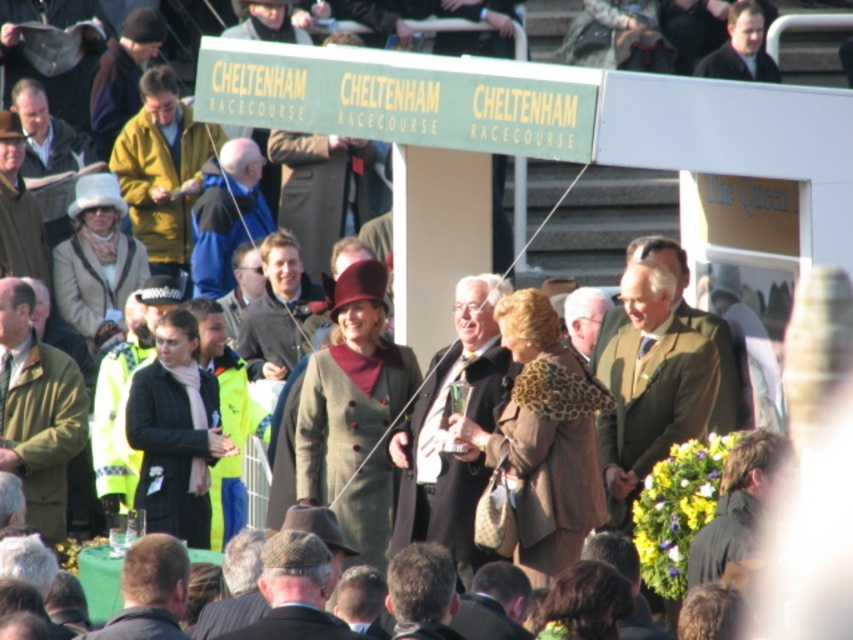
Question: Is green wool coat at left smaller than brown tweed hat at lower center?

Choices:
 (A) yes
 (B) no

Answer: (B)

Question: Which point appears closest to the camera in this image?

Choices:
 (A) (289, 257)
 (B) (175, 579)
 (C) (247, 163)
 (D) (625, 476)

Answer: (B)

Question: Which point is farther from the camera taking this photo?

Choices:
 (A) (439, 387)
 (B) (65, 513)

Answer: (B)

Question: Among these objects, which one is nearest to the camera?

Choices:
 (A) dark gray sweater at center
 (B) dark brown hair at lower left
 (C) yellow jacket at upper left
 (D) green wool coat at center

Answer: (B)

Question: Can you confirm if green wool coat at center is thinner than green wool coat at left?

Choices:
 (A) yes
 (B) no

Answer: (B)

Question: In this image, where is yellow jacket at upper left located relative to brown tweed hat at lower center?

Choices:
 (A) above
 (B) below

Answer: (A)